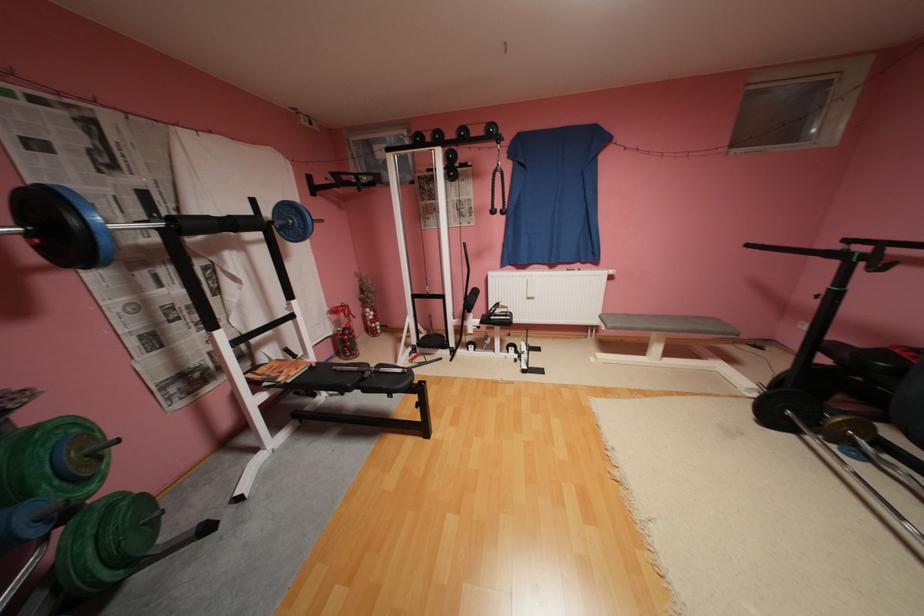
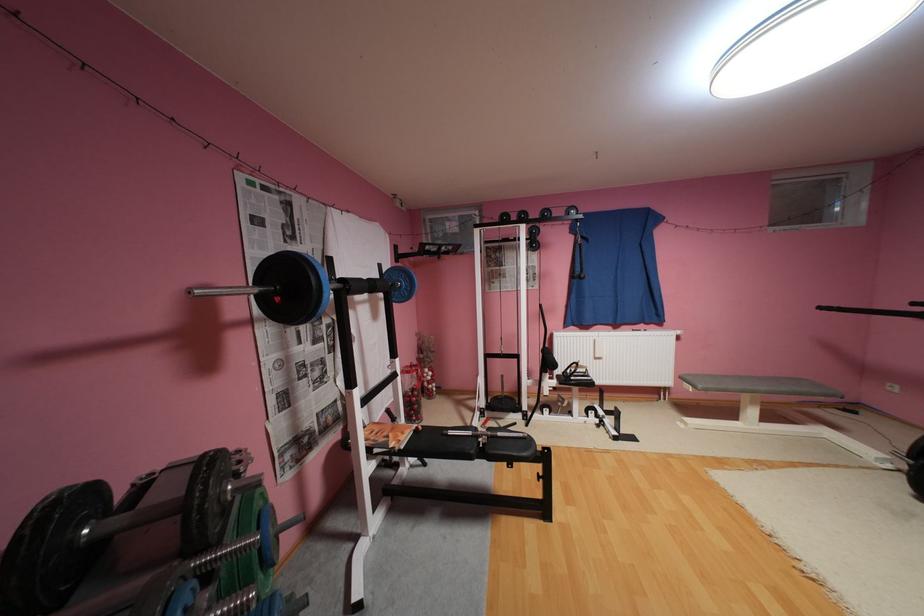
Locate, in the second image, the point that corresponds to point 82,222 in the first image.

(322, 283)